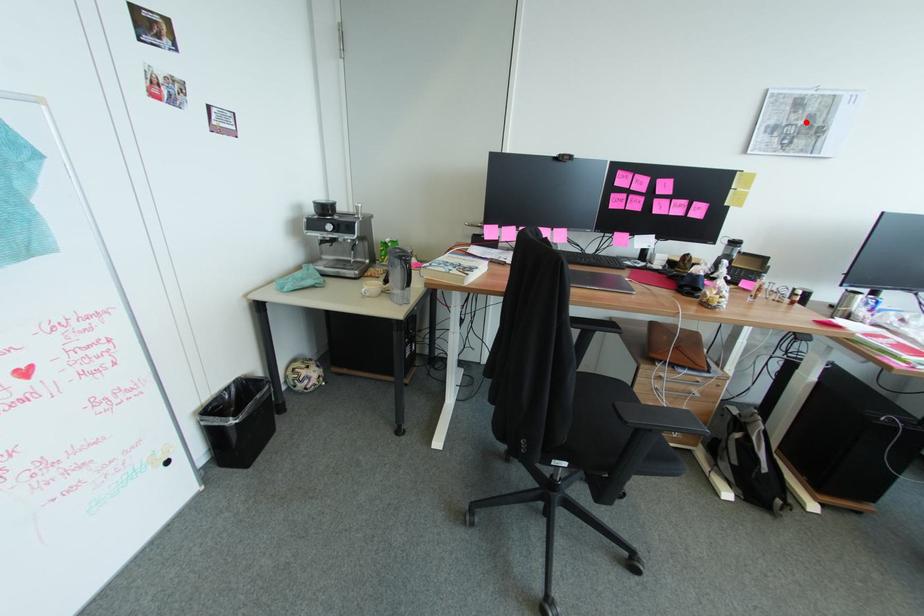
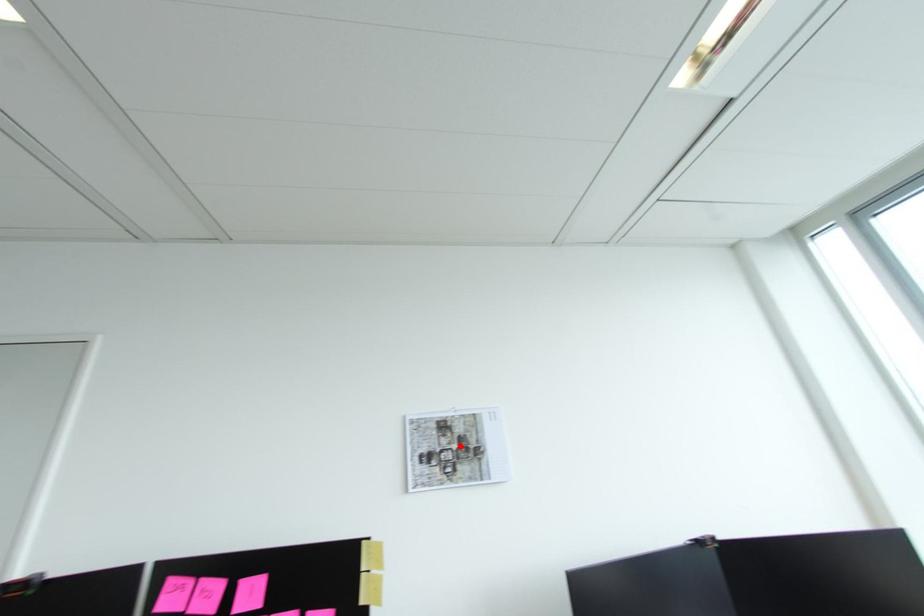
Looking at this image, I am providing you with two images of the same scene from different viewpoints. A red point is marked on the first image and another point is marked on the second image. Is the marked point in image1 the same physical position as the marked point in image2?

Yes